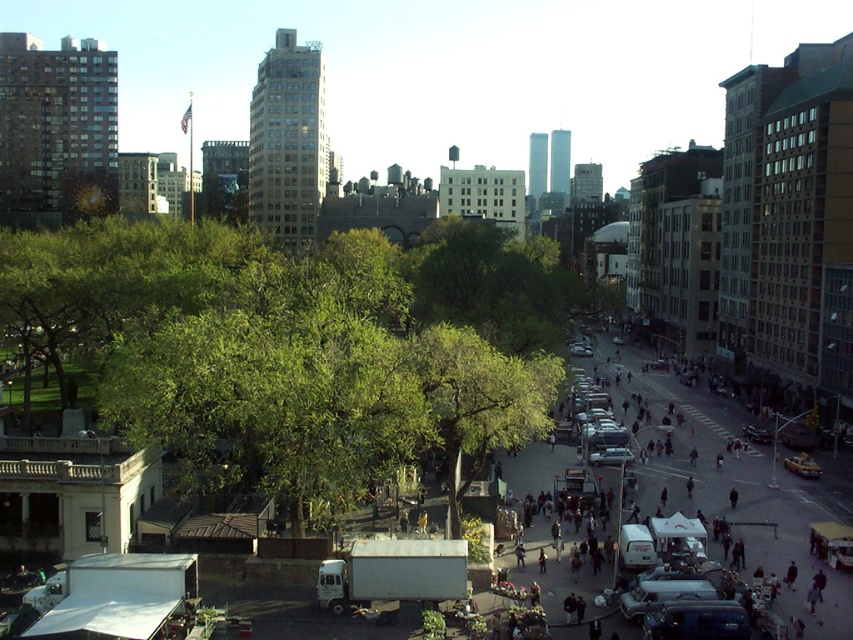
Between green leafy tree at center-left and green leafy tree at center, which one has less height?

green leafy tree at center

Measure the distance between green leafy tree at center-left and camera.

The distance of green leafy tree at center-left from camera is 211.40 feet.

This screenshot has width=853, height=640. Find the location of `green leafy tree at center-left`. green leafy tree at center-left is located at coordinates (297, 346).